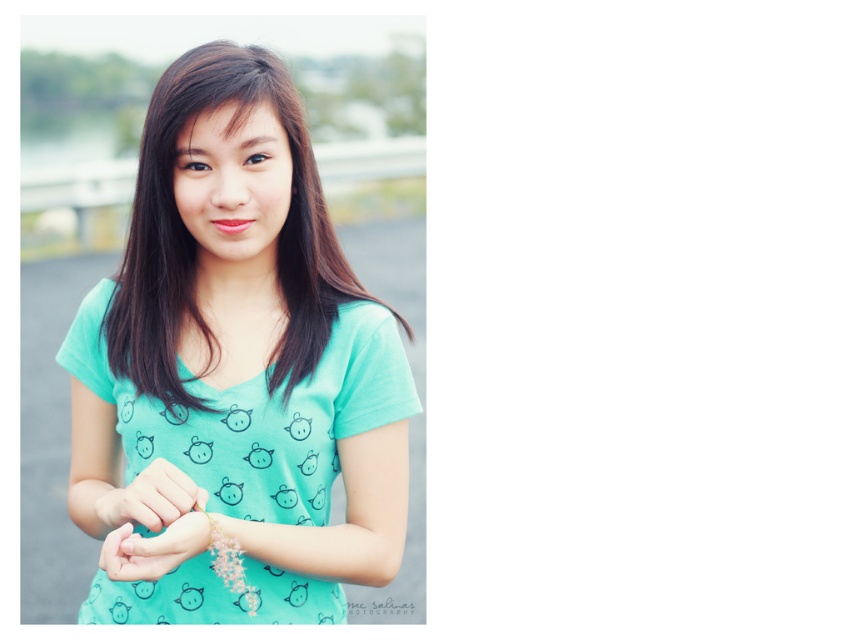
Question: Which point appears closest to the camera in this image?

Choices:
 (A) click(x=143, y=554)
 (B) click(x=285, y=362)

Answer: (A)

Question: Can you confirm if matte gold bracelet at center is positioned below matte teal shirt at center?

Choices:
 (A) no
 (B) yes

Answer: (A)

Question: Can you confirm if mint green fabric shirt at center is bigger than matte gold bracelet at center?

Choices:
 (A) yes
 (B) no

Answer: (A)

Question: Estimate the real-world distances between objects in this image. Which object is farther from the matte teal shirt at center?

Choices:
 (A) mint green fabric shirt at center
 (B) matte gold bracelet at center

Answer: (A)

Question: Considering the real-world distances, which object is closest to the mint green fabric shirt at center?

Choices:
 (A) matte teal shirt at center
 (B) matte gold bracelet at center

Answer: (B)

Question: Considering the relative positions of matte gold bracelet at center and matte teal shirt at center in the image provided, where is matte gold bracelet at center located with respect to matte teal shirt at center?

Choices:
 (A) right
 (B) left

Answer: (B)